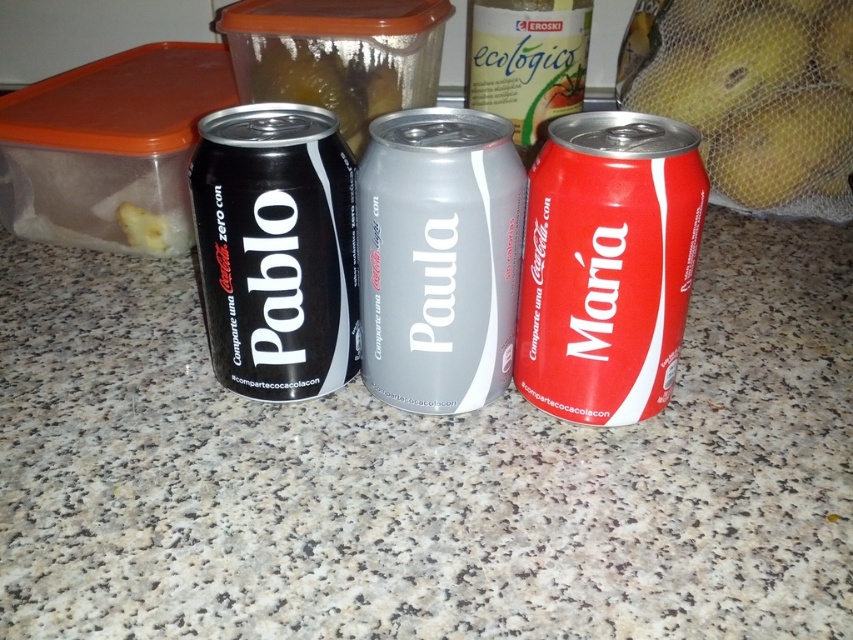
How distant is black matte can at center from yellow mesh bag at right?

black matte can at center is 86.79 centimeters away from yellow mesh bag at right.

At what (x,y) coordinates should I click in order to perform the action: click on black matte can at center. Please return your answer as a coordinate pair (x, y). This screenshot has height=640, width=853. Looking at the image, I should click on (276, 250).

This screenshot has width=853, height=640. What do you see at coordinates (438, 257) in the screenshot?
I see `satin silver can at center` at bounding box center [438, 257].

How much distance is there between satin silver can at center and red matte can at center?

28.42 inches

Who is more forward, [395,141] or [525,38]?

Point [395,141] is in front.

Locate an element on the screen. satin silver can at center is located at coordinates (438, 257).

Is satin silver can at center taller than yellow mesh bag at right?

Incorrect, satin silver can at center's height is not larger of yellow mesh bag at right's.

Does satin silver can at center have a lesser width compared to yellow mesh bag at right?

Yes, satin silver can at center is thinner than yellow mesh bag at right.

Is point (413, 180) farther from viewer compared to point (724, 161)?

No, it is in front of (724, 161).

Locate an element on the screen. satin silver can at center is located at coordinates (438, 257).